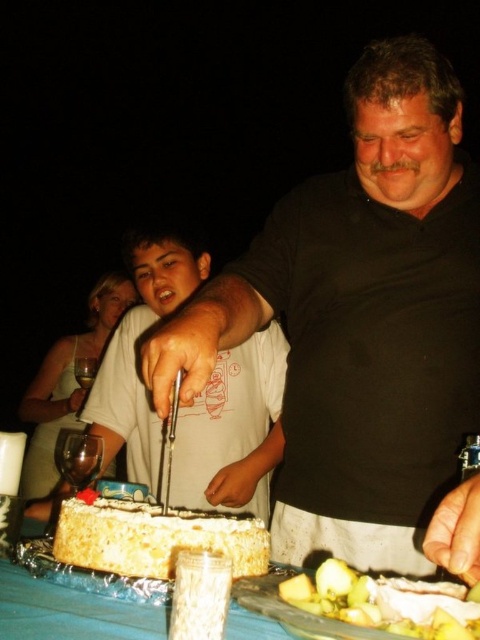
Question: Which point appears closest to the camera in this image?

Choices:
 (A) (466, 371)
 (B) (94, 371)

Answer: (A)

Question: Among these objects, which one is farthest from the camera?

Choices:
 (A) black matte shirt at center
 (B) matte black shirt at center

Answer: (B)

Question: Considering the relative positions of white frosted cake at center and transparent glass wine at left in the image provided, where is white frosted cake at center located with respect to transparent glass wine at left?

Choices:
 (A) below
 (B) above

Answer: (A)

Question: Estimate the real-world distances between objects in this image. Which object is closer to the matte black shirt at center?

Choices:
 (A) black matte shirt at center
 (B) transparent glass wine glass at lower left

Answer: (A)

Question: Does black matte shirt at center appear on the right side of white frosted cake at center?

Choices:
 (A) yes
 (B) no

Answer: (A)

Question: From the image, what is the correct spatial relationship of black matte shirt at center in relation to transparent glass wine glass at lower left?

Choices:
 (A) below
 (B) above

Answer: (B)